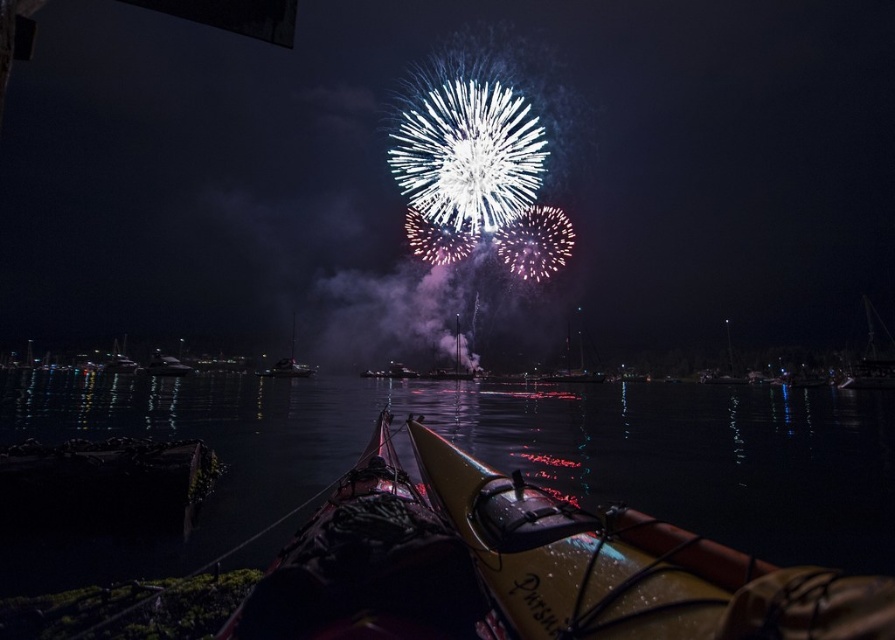
Which is below, metallic yellow kayak at center or glossy water at center?

glossy water at center is lower down.

Can you confirm if metallic yellow kayak at center is shorter than glossy water at center?

No, metallic yellow kayak at center is not shorter than glossy water at center.

Is point (701, 269) in front of point (271, 408)?

No.

Image resolution: width=895 pixels, height=640 pixels. I want to click on metallic yellow kayak at center, so click(405, 198).

The height and width of the screenshot is (640, 895). Find the location of `glossy water at center`. glossy water at center is located at coordinates tap(668, 432).

Consider the image. Is glossy water at center closer to camera compared to yellow matte canoe at center?

No, glossy water at center is further to the viewer.

Which is in front, point (800, 445) or point (347, 618)?

Point (347, 618) is more forward.

Locate an element on the screen. glossy water at center is located at coordinates (668, 432).

Image resolution: width=895 pixels, height=640 pixels. In order to click on metallic yellow kayak at center in this screenshot , I will do `click(405, 198)`.

Is metallic yellow kayak at center behind yellow matte canoe at center?

Yes.

Which is behind, point (280, 273) or point (391, 538)?

The point (280, 273) is behind.

The image size is (895, 640). In order to click on metallic yellow kayak at center in this screenshot , I will do `click(405, 198)`.